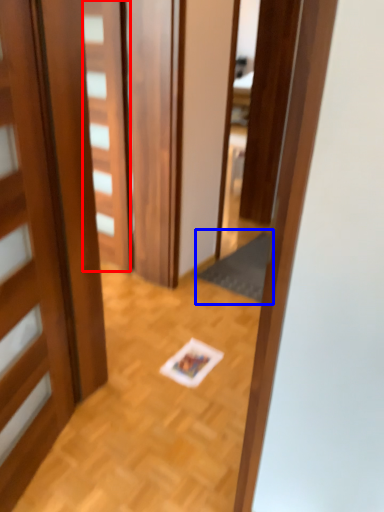
Question: Which of the following is the closest to the observer, door (highlighted by a red box) or doormat (highlighted by a blue box)?

Choices:
 (A) door
 (B) doormat

Answer: (A)